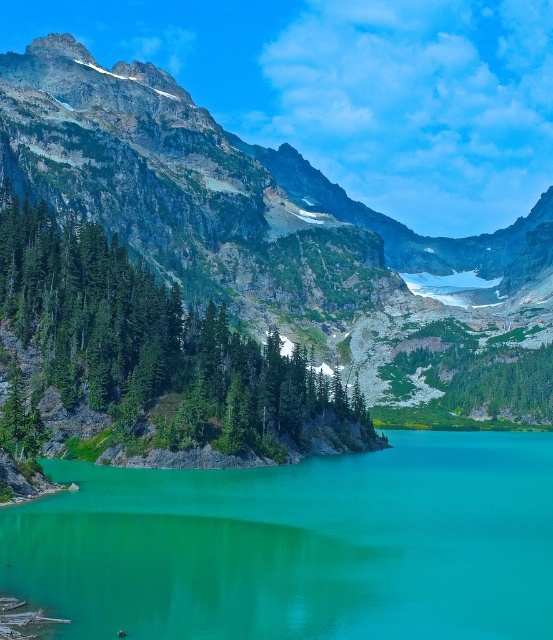
You are standing at the edge of the lake and want to take a photo of the rugged granite mountain at upper left with the turquoise glossy water at center in the background. Is the mountain blocking the view of the water?

The turquoise glossy water at center is behind the rugged granite mountain at upper left, so the mountain is blocking the view of the water.